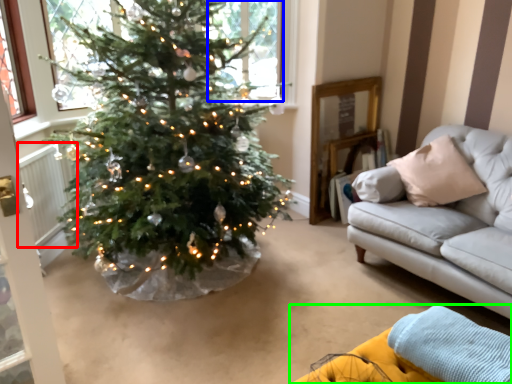
Question: Which is nearer to the radiator (highlighted by a red box)? window (highlighted by a blue box) or couch (highlighted by a green box).

Choices:
 (A) window
 (B) couch

Answer: (A)